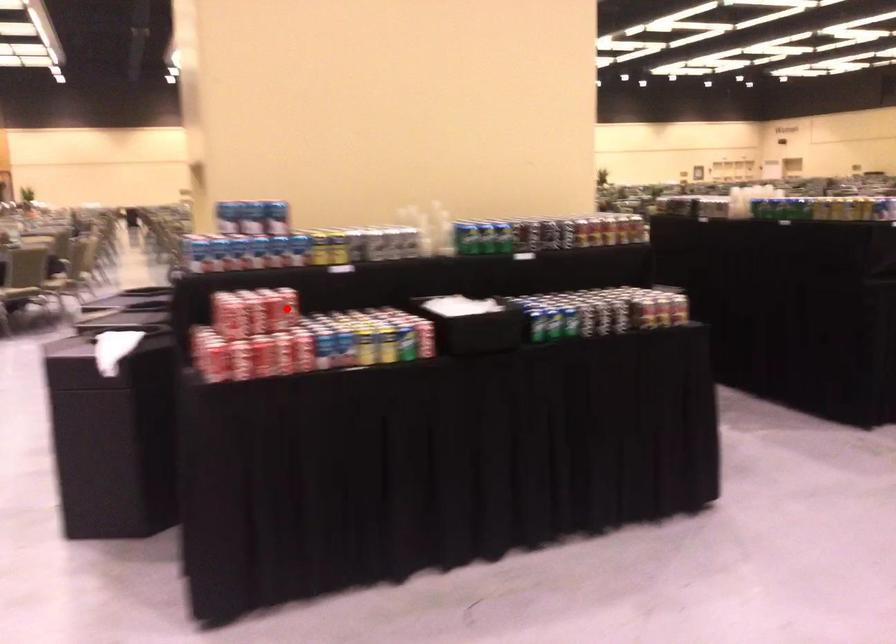
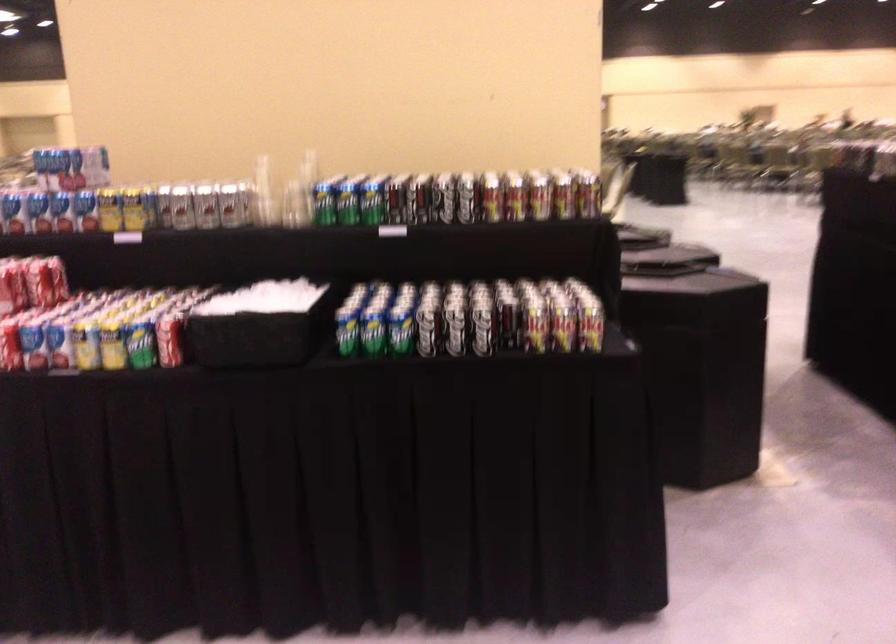
Find the pixel in the second image that matches the highlighted location in the first image.

(40, 283)